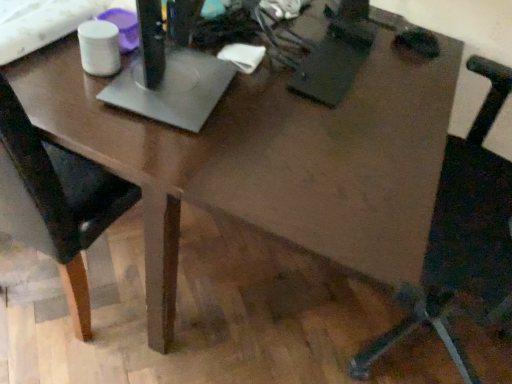
Based on the photo, measure the distance between black leather chair at left, which is counted as the first chair, starting from the left, and camera.

A distance of 24.29 inches exists between black leather chair at left, which is counted as the first chair, starting from the left, and camera.

The image size is (512, 384). Find the location of `black leather chair at left, the second chair viewed from the right`. black leather chair at left, the second chair viewed from the right is located at coordinates (56, 201).

This screenshot has width=512, height=384. What do you see at coordinates (56, 201) in the screenshot?
I see `black leather chair at left, the second chair viewed from the right` at bounding box center [56, 201].

Describe the element at coordinates (464, 234) in the screenshot. The width and height of the screenshot is (512, 384). I see `black leather chair at right, which is the 2th chair from left to right` at that location.

Measure the distance between black leather chair at right, which is the 2th chair from left to right, and camera.

black leather chair at right, which is the 2th chair from left to right, is 32.48 inches from camera.

At what (x,y) coordinates should I click in order to perform the action: click on black leather chair at right, which is the 2th chair from left to right. Please return your answer as a coordinate pair (x, y). Looking at the image, I should click on (464, 234).

Locate an element on the screen. The image size is (512, 384). black leather chair at left, the second chair viewed from the right is located at coordinates (56, 201).

Can you confirm if black leather chair at right, which is the 2th chair from left to right, is positioned to the left of black leather chair at left, the second chair viewed from the right?

No, black leather chair at right, which is the 2th chair from left to right, is not to the left of black leather chair at left, the second chair viewed from the right.

Between black leather chair at right, which is the 2th chair from left to right, and black leather chair at left, the second chair viewed from the right, which one is positioned behind?

black leather chair at left, the second chair viewed from the right.

Between point (486, 216) and point (137, 200), which one is positioned behind?

The point (137, 200) is farther from the camera.

From the image's perspective, is black leather chair at right, which is the 2th chair from left to right, on top of black leather chair at left, which is counted as the first chair, starting from the left?

Actually, black leather chair at right, which is the 2th chair from left to right, appears below black leather chair at left, which is counted as the first chair, starting from the left, in the image.

From a real-world perspective, who is located higher, black leather chair at right, which is the 2th chair from left to right, or black leather chair at left, which is counted as the first chair, starting from the left?

From a 3D spatial view, black leather chair at right, which is the 2th chair from left to right, is above.

Does black leather chair at right, which is the 1th chair in right-to-left order, have a lesser width compared to black leather chair at left, the second chair viewed from the right?

In fact, black leather chair at right, which is the 1th chair in right-to-left order, might be wider than black leather chair at left, the second chair viewed from the right.

Consider the image. In terms of height, does black leather chair at right, which is the 2th chair from left to right, look taller or shorter compared to black leather chair at left, the second chair viewed from the right?

Considering their sizes, black leather chair at right, which is the 2th chair from left to right, has more height than black leather chair at left, the second chair viewed from the right.

Is black leather chair at right, which is the 1th chair in right-to-left order, smaller than black leather chair at left, the second chair viewed from the right?

No.

Is black leather chair at left, the second chair viewed from the right, a part of black leather chair at right, which is the 2th chair from left to right?

No, black leather chair at left, the second chair viewed from the right, is not a part of black leather chair at right, which is the 2th chair from left to right.

Are black leather chair at right, which is the 2th chair from left to right, and black leather chair at left, which is counted as the first chair, starting from the left, beside each other?

They are not placed beside each other.

Is black leather chair at right, which is the 1th chair in right-to-left order, oriented towards black leather chair at left, the second chair viewed from the right?

Yes, black leather chair at right, which is the 1th chair in right-to-left order, is aimed at black leather chair at left, the second chair viewed from the right.

Could you measure the distance between black leather chair at right, which is the 2th chair from left to right, and black leather chair at left, which is counted as the first chair, starting from the left?

A distance of 31.45 inches exists between black leather chair at right, which is the 2th chair from left to right, and black leather chair at left, which is counted as the first chair, starting from the left.

Where is `chair behind the black leather chair at right, which is the 1th chair in right-to-left order`? chair behind the black leather chair at right, which is the 1th chair in right-to-left order is located at coordinates (56, 201).

Between black leather chair at left, the second chair viewed from the right, and black leather chair at right, which is the 1th chair in right-to-left order, which one appears on the right side from the viewer's perspective?

black leather chair at right, which is the 1th chair in right-to-left order, is more to the right.

Is black leather chair at left, the second chair viewed from the right, further to camera compared to black leather chair at right, which is the 1th chair in right-to-left order?

Yes, black leather chair at left, the second chair viewed from the right, is behind black leather chair at right, which is the 1th chair in right-to-left order.

Which is closer, (118, 200) or (487, 155)?

Point (118, 200) appears to be closer to the viewer than point (487, 155).

From the image's perspective, which one is positioned higher, black leather chair at left, the second chair viewed from the right, or black leather chair at right, which is the 2th chair from left to right?

black leather chair at left, the second chair viewed from the right, appears higher in the image.

From a real-world perspective, relative to black leather chair at right, which is the 1th chair in right-to-left order, is black leather chair at left, which is counted as the first chair, starting from the left, vertically above or below?

black leather chair at left, which is counted as the first chair, starting from the left, is situated lower than black leather chair at right, which is the 1th chair in right-to-left order, in the real world.

Can you confirm if black leather chair at left, the second chair viewed from the right, is wider than black leather chair at right, which is the 2th chair from left to right?

In fact, black leather chair at left, the second chair viewed from the right, might be narrower than black leather chair at right, which is the 2th chair from left to right.

Is black leather chair at left, the second chair viewed from the right, shorter than black leather chair at right, which is the 1th chair in right-to-left order?

Yes, black leather chair at left, the second chair viewed from the right, is shorter than black leather chair at right, which is the 1th chair in right-to-left order.

Which of these two, black leather chair at left, the second chair viewed from the right, or black leather chair at right, which is the 1th chair in right-to-left order, is bigger?

With larger size is black leather chair at right, which is the 1th chair in right-to-left order.

Is black leather chair at left, which is counted as the first chair, starting from the left, not within black leather chair at right, which is the 2th chair from left to right?

black leather chair at left, which is counted as the first chair, starting from the left, lies outside black leather chair at right, which is the 2th chair from left to right,'s area.

Does black leather chair at left, which is counted as the first chair, starting from the left, touch black leather chair at right, which is the 1th chair in right-to-left order?

They are not placed beside each other.

Does black leather chair at left, the second chair viewed from the right, turn towards black leather chair at right, which is the 1th chair in right-to-left order?

No.

Find the location of a particular element. chair above the black leather chair at right, which is the 2th chair from left to right (from the image's perspective) is located at coordinates (56, 201).

The image size is (512, 384). I want to click on chair above the black leather chair at left, the second chair viewed from the right (from a real-world perspective), so click(x=464, y=234).

Where is `chair that appears below the black leather chair at right, which is the 1th chair in right-to-left order (from a real-world perspective)`? The height and width of the screenshot is (384, 512). chair that appears below the black leather chair at right, which is the 1th chair in right-to-left order (from a real-world perspective) is located at coordinates (56, 201).